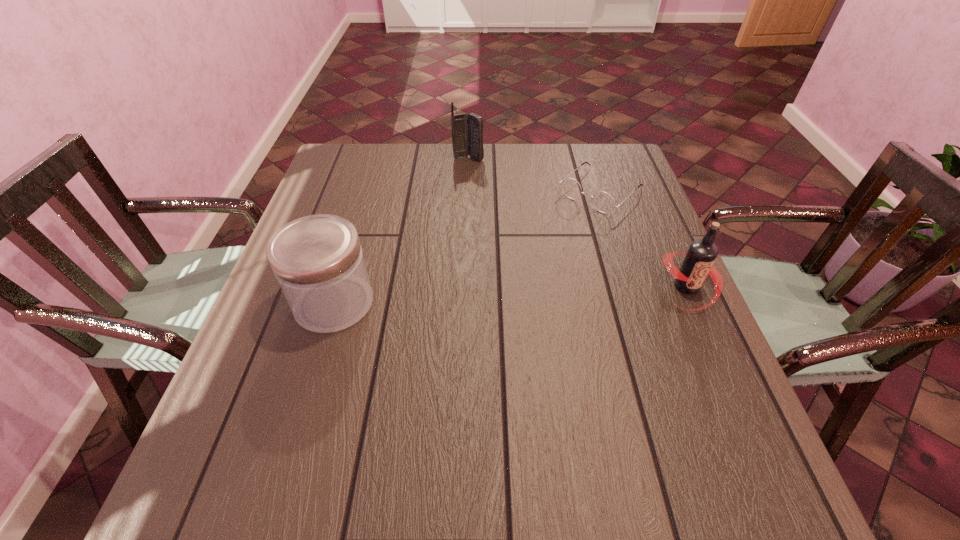
I want to click on free spot between the second object from left to right and the jar, so click(401, 231).

Image resolution: width=960 pixels, height=540 pixels. I want to click on vacant point located between the leftmost object and the spectacles, so click(x=468, y=247).

Identify the location of free space between the cellular telephone and the root beer. This screenshot has width=960, height=540. (578, 222).

Image resolution: width=960 pixels, height=540 pixels. I want to click on empty space that is in between the cellular telephone and the leftmost object, so click(401, 231).

This screenshot has width=960, height=540. I want to click on free space between the root beer and the shortest object, so click(x=644, y=239).

Identify which object is the nearest to the root beer. Please provide its 2D coordinates. Your answer should be formatted as a tuple, i.e. [(x, y)], where the tuple contains the x and y coordinates of a point satisfying the conditions above.

[(603, 201)]

Locate an element on the screen. The width and height of the screenshot is (960, 540). object that stands as the second closest to the root beer is located at coordinates (467, 131).

Locate an element on the screen. The width and height of the screenshot is (960, 540). vacant region that satisfies the following two spatial constraints: 1. on the back side of the leftmost object; 2. on the right side of the shortest object is located at coordinates (368, 191).